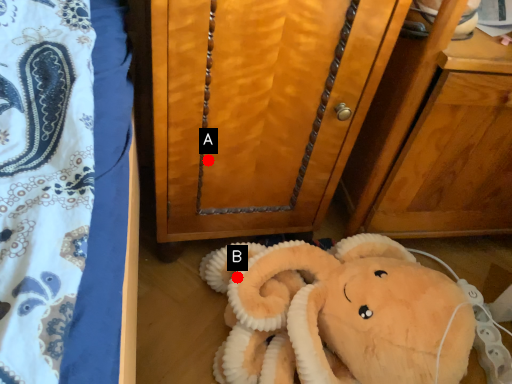
Question: Two points are circled on the image, labeled by A and B beside each circle. Which point is further to the camera?

Choices:
 (A) A is further
 (B) B is further

Answer: (B)